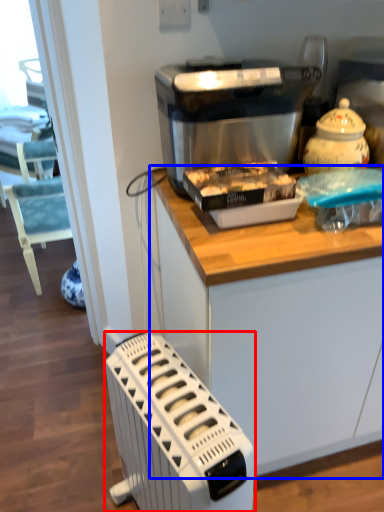
Question: Which object is closer to the camera taking this photo, home appliance (highlighted by a red box) or cabinetry (highlighted by a blue box)?

Choices:
 (A) home appliance
 (B) cabinetry

Answer: (A)